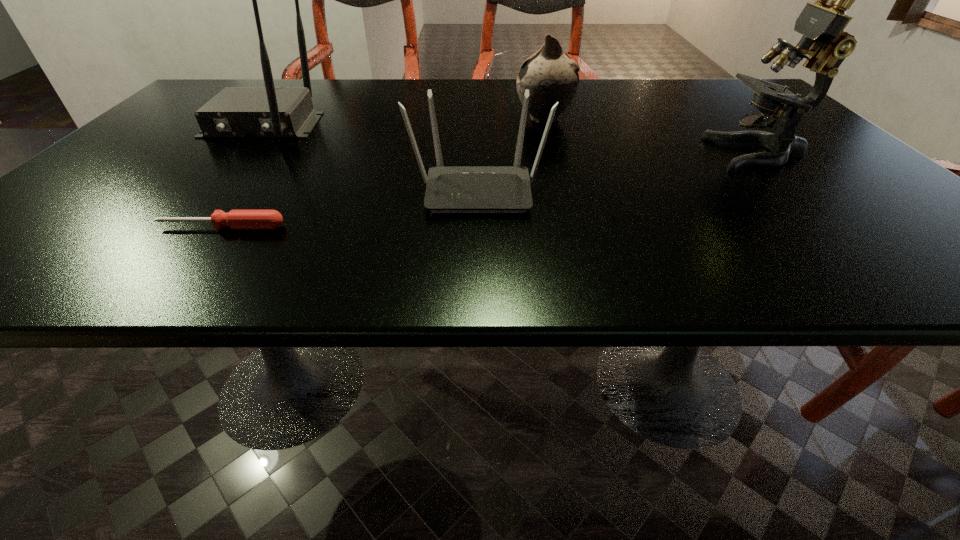
In order to click on free space located 0.320m at the eyepieces of the microscope in this screenshot , I will do `click(559, 153)`.

At what (x,y) coordinates should I click in order to perform the action: click on blank space located at the eyepieces of the microscope. Please return your answer as a coordinate pair (x, y). The height and width of the screenshot is (540, 960). Looking at the image, I should click on (680, 153).

Identify the location of free spot located on the back of the left router to connect cables. Image resolution: width=960 pixels, height=540 pixels. (157, 244).

Identify the location of vacant space situated from the spout of the pottery. Image resolution: width=960 pixels, height=540 pixels. (425, 119).

The width and height of the screenshot is (960, 540). I want to click on free space located 0.270m from the spout of the pottery, so [400, 119].

This screenshot has width=960, height=540. Identify the location of vacant region located 0.390m from the spout of the pottery. (349, 119).

The width and height of the screenshot is (960, 540). I want to click on vacant space located on the front-facing side of the nearer router, so click(x=478, y=259).

This screenshot has width=960, height=540. Find the location of `vacant space situated 0.090m on the left of the shortest object`. vacant space situated 0.090m on the left of the shortest object is located at coordinates (103, 227).

Locate an element on the screen. Image resolution: width=960 pixels, height=540 pixels. router that is at the far edge is located at coordinates (269, 111).

This screenshot has width=960, height=540. I want to click on pottery that is at the far edge, so click(550, 76).